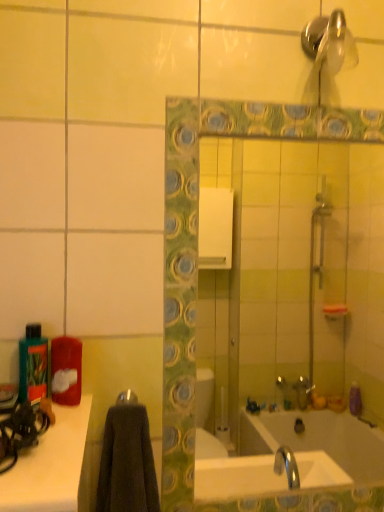
The width and height of the screenshot is (384, 512). What do you see at coordinates (330, 42) in the screenshot? I see `shiny metallic shower head at upper right` at bounding box center [330, 42].

Measure the distance between point (260,310) and camera.

2.76 meters.

Image resolution: width=384 pixels, height=512 pixels. What do you see at coordinates (127, 398) in the screenshot? I see `metallic silver towel bar at center` at bounding box center [127, 398].

Locate an element on the screen. green matte bottle at left is located at coordinates (33, 365).

Locate an element on the screen. The height and width of the screenshot is (512, 384). shiny metallic shower head at upper right is located at coordinates (330, 42).

Considering the sizes of objects green mosaic tile mirror at center and shiny metallic shower head at upper right in the image provided, who is shorter, green mosaic tile mirror at center or shiny metallic shower head at upper right?

Standing shorter between the two is shiny metallic shower head at upper right.

Could you measure the distance between green mosaic tile mirror at center and shiny metallic shower head at upper right?

A distance of 2.07 meters exists between green mosaic tile mirror at center and shiny metallic shower head at upper right.

From the image's perspective, is green mosaic tile mirror at center beneath shiny metallic shower head at upper right?

Yes, from the image's perspective, green mosaic tile mirror at center is beneath shiny metallic shower head at upper right.

Who is bigger, green mosaic tile mirror at center or shiny metallic shower head at upper right?

green mosaic tile mirror at center is bigger.

Is green matte bottle at left taller or shorter than shiny metallic shower head at upper right?

In the image, green matte bottle at left appears to be taller than shiny metallic shower head at upper right.

Can you see green matte bottle at left touching shiny metallic shower head at upper right?

A: No, green matte bottle at left is not in contact with shiny metallic shower head at upper right.

Between point (36, 392) and point (344, 42), which one is positioned behind?

Point (344, 42)

Is green matte bottle at left beside metallic silver towel bar at center?

green matte bottle at left and metallic silver towel bar at center are clearly separated.

Which is in front, point (42, 379) or point (120, 395)?

Point (42, 379)

Which of these two, green matte bottle at left or metallic silver towel bar at center, stands taller?

Standing taller between the two is green matte bottle at left.

Is shiny metallic shower head at upper right not close to green mosaic tile mirror at center?

Yes, shiny metallic shower head at upper right is far from green mosaic tile mirror at center.

Is shiny metallic shower head at upper right smaller than green mosaic tile mirror at center?

Indeed, shiny metallic shower head at upper right has a smaller size compared to green mosaic tile mirror at center.

Based on the photo, from the image's perspective, is shiny metallic shower head at upper right on top of green mosaic tile mirror at center?

Yes, from the image's perspective, shiny metallic shower head at upper right is above green mosaic tile mirror at center.

What's the angular difference between shiny metallic shower head at upper right and green mosaic tile mirror at center's facing directions?

They differ by 0.496 degrees in their facing directions.

Could you measure the distance between metallic silver towel bar at center and shiny metallic shower head at upper right?

The distance of metallic silver towel bar at center from shiny metallic shower head at upper right is 30.46 inches.

Is metallic silver towel bar at center positioned behind shiny metallic shower head at upper right?

Yes, it is behind shiny metallic shower head at upper right.

From a real-world perspective, is metallic silver towel bar at center above or below shiny metallic shower head at upper right?

metallic silver towel bar at center is situated lower than shiny metallic shower head at upper right in the real world.

Based on the photo, is metallic silver towel bar at center far from shiny metallic shower head at upper right?

metallic silver towel bar at center is actually quite close to shiny metallic shower head at upper right.

Would you consider green matte bottle at left to be distant from green mosaic tile mirror at center?

green matte bottle at left is far away from green mosaic tile mirror at center.

From a real-world perspective, which object rests below the other?

green matte bottle at left is physically lower.

Is green matte bottle at left not inside green mosaic tile mirror at center?

Yes, green matte bottle at left is outside of green mosaic tile mirror at center.

Between green matte bottle at left and green mosaic tile mirror at center, which one is positioned behind?

Positioned behind is green mosaic tile mirror at center.

From a real-world perspective, is green mosaic tile mirror at center physically below green matte bottle at left?

No, from a real-world perspective, green mosaic tile mirror at center is not under green matte bottle at left.

From the image's perspective, relative to green matte bottle at left, is green mosaic tile mirror at center above or below?

green mosaic tile mirror at center is situated higher than green matte bottle at left in the image.

Is green mosaic tile mirror at center touching green matte bottle at left?

No, green mosaic tile mirror at center is not touching green matte bottle at left.

Locate an element on the screen. Image resolution: width=384 pixels, height=512 pixels. mirror lying behind the shiny metallic shower head at upper right is located at coordinates click(298, 328).

Locate an element on the screen. bottle below the shiny metallic shower head at upper right (from a real-world perspective) is located at coordinates [33, 365].

When comparing their distances from metallic silver towel bar at center, does green mosaic tile mirror at center or shiny metallic shower head at upper right seem closer?

shiny metallic shower head at upper right lies closer to metallic silver towel bar at center than the other object.

When comparing their distances from green matte bottle at left, does shiny metallic shower head at upper right or green mosaic tile mirror at center seem further?

green mosaic tile mirror at center lies further to green matte bottle at left than the other object.

When comparing their distances from green matte bottle at left, does metallic silver towel bar at center or shiny metallic shower head at upper right seem closer?

Based on the image, metallic silver towel bar at center appears to be nearer to green matte bottle at left.

From the picture: From the image, which object appears to be nearer to green matte bottle at left, metallic silver towel bar at center or green mosaic tile mirror at center?

metallic silver towel bar at center.

When comparing their distances from green matte bottle at left, does green mosaic tile mirror at center or metallic silver towel bar at center seem closer?

metallic silver towel bar at center lies closer to green matte bottle at left than the other object.

Which object lies nearer to the anchor point shiny metallic shower head at upper right, metallic silver towel bar at center or green matte bottle at left?

metallic silver towel bar at center is closer to shiny metallic shower head at upper right.

When comparing their distances from green mosaic tile mirror at center, does shiny metallic shower head at upper right or metallic silver towel bar at center seem further?

The object further to green mosaic tile mirror at center is metallic silver towel bar at center.

Consider the image. Which object lies further to the anchor point shiny metallic shower head at upper right, metallic silver towel bar at center or green mosaic tile mirror at center?

green mosaic tile mirror at center is positioned further to the anchor shiny metallic shower head at upper right.

The image size is (384, 512). Find the location of `mirror between shiny metallic shower head at upper right and metallic silver towel bar at center vertically`. mirror between shiny metallic shower head at upper right and metallic silver towel bar at center vertically is located at coordinates (298, 328).

The width and height of the screenshot is (384, 512). In order to click on towel bar between green matte bottle at left and green mosaic tile mirror at center in the horizontal direction in this screenshot , I will do `click(127, 398)`.

Locate an element on the screen. bottle that lies between shiny metallic shower head at upper right and metallic silver towel bar at center from top to bottom is located at coordinates (33, 365).

Image resolution: width=384 pixels, height=512 pixels. I want to click on mirror between shiny metallic shower head at upper right and green matte bottle at left in the up-down direction, so click(298, 328).